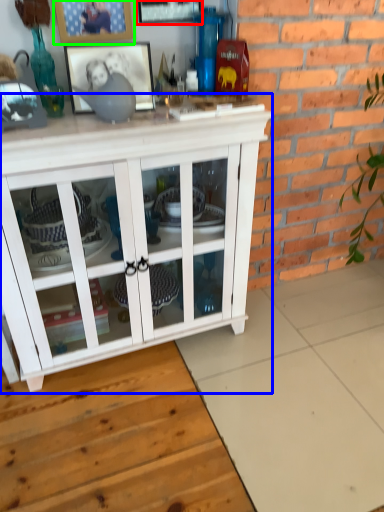
Question: Which object is positioned farthest from picture frame (highlighted by a red box)? Select from cabinetry (highlighted by a blue box) and picture frame (highlighted by a green box).

Choices:
 (A) cabinetry
 (B) picture frame

Answer: (A)